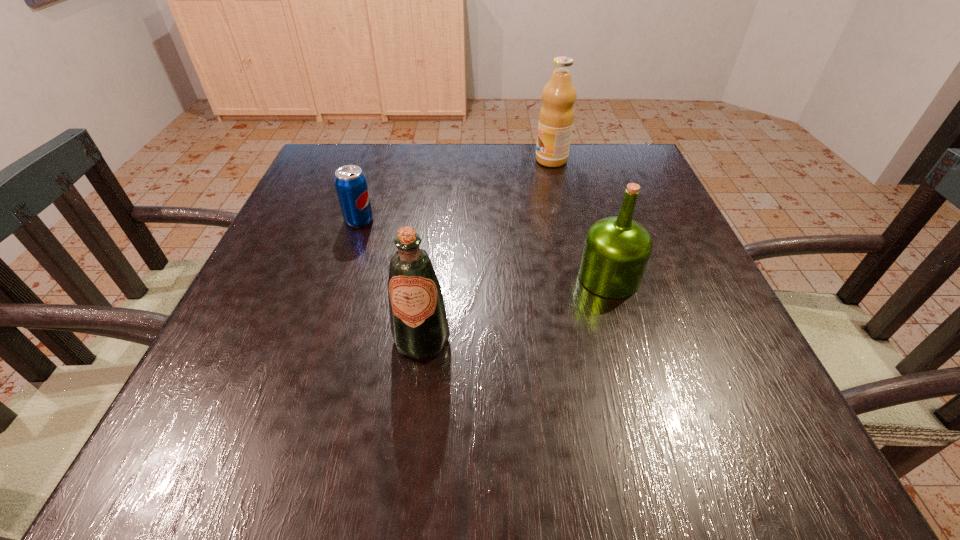
In the image, there is a desktop. Where is `vacant area at the near left corner`? This screenshot has width=960, height=540. vacant area at the near left corner is located at coordinates (177, 462).

What are the coordinates of `vacant space at the far right corner` in the screenshot? It's located at pos(602,178).

The width and height of the screenshot is (960, 540). Find the location of `vacant space at the near right corner of the desktop`. vacant space at the near right corner of the desktop is located at coordinates click(x=781, y=463).

Locate an element on the screen. The height and width of the screenshot is (540, 960). unoccupied area between the third object from right to left and the farthest olive oil is located at coordinates (487, 250).

Identify the location of empty location between the nearest object and the farthest object. (487, 250).

Identify the location of free space between the leftmost olive oil and the farthest olive oil. Image resolution: width=960 pixels, height=540 pixels. tap(487, 250).

Identify the location of vacant area that lies between the nearest object and the farthest object. The height and width of the screenshot is (540, 960). (487, 250).

Where is `unoccupied position between the nearest olive oil and the farthest olive oil`? Image resolution: width=960 pixels, height=540 pixels. unoccupied position between the nearest olive oil and the farthest olive oil is located at coordinates (487, 250).

Identify the location of free spot between the pop soda and the farthest object. The width and height of the screenshot is (960, 540). (455, 190).

Image resolution: width=960 pixels, height=540 pixels. I want to click on free space between the second nearest object and the third nearest object, so click(484, 249).